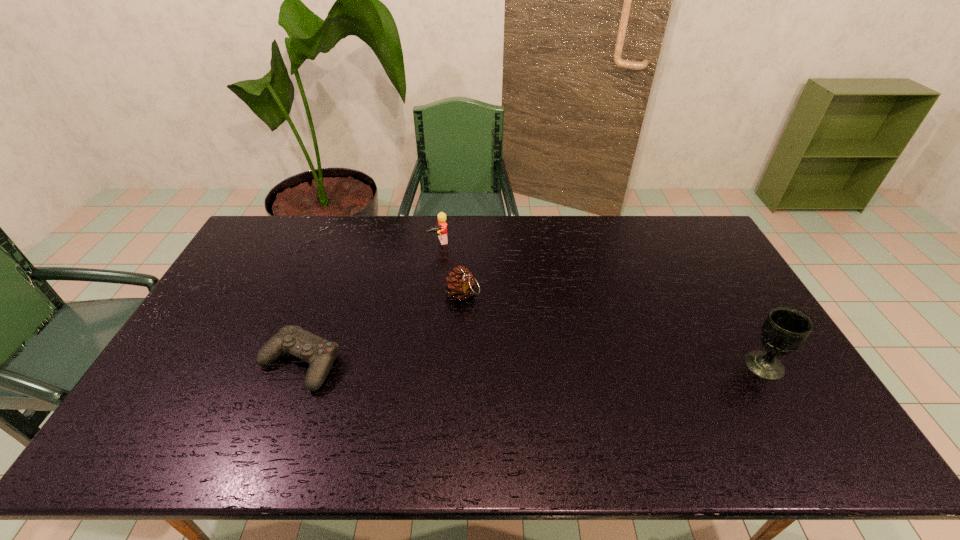
Find the location of `vacant area that lies between the third object from right to left and the control`. vacant area that lies between the third object from right to left and the control is located at coordinates (369, 303).

Where is `empty space that is in between the chalice and the second object from left to right`? The width and height of the screenshot is (960, 540). empty space that is in between the chalice and the second object from left to right is located at coordinates (601, 303).

The height and width of the screenshot is (540, 960). Identify the location of vacant space that is in between the third object from right to left and the control. (369, 303).

Identify which object is located as the nearest to the third nearest object. Please provide its 2D coordinates. Your answer should be formatted as a tuple, i.e. [(x, y)], where the tuple contains the x and y coordinates of a point satisfying the conditions above.

[(442, 225)]

I want to click on object that stands as the second closest to the third object from right to left, so click(320, 353).

At what (x,y) coordinates should I click in order to perform the action: click on vacant space that satisfies the following two spatial constraints: 1. on the front side of the tallest object; 2. on the left side of the shortest object. Please return your answer as a coordinate pair (x, y). Looking at the image, I should click on (300, 365).

You are a GUI agent. You are given a task and a screenshot of the screen. Output one action in this format:
    pyautogui.click(x=<x>, y=<y>)
    Task: Click on the vacant area in the image that satisfies the following two spatial constraints: 1. on the front side of the second farthest object; 2. on the left side of the rightmost object
    This screenshot has height=540, width=960.
    Given the screenshot: What is the action you would take?
    pyautogui.click(x=460, y=365)